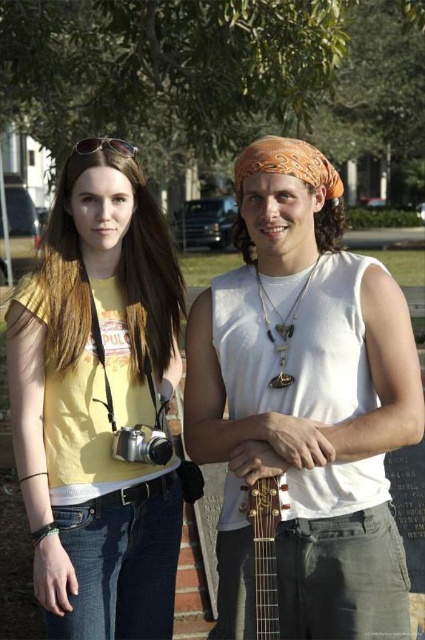
Is orange bandana at center above wooden acoustic guitar at center?

Yes, orange bandana at center is above wooden acoustic guitar at center.

Who is taller, orange bandana at center or wooden acoustic guitar at center?

orange bandana at center

Is point (295, 253) farther from viewer compared to point (255, 545)?

Yes.

The height and width of the screenshot is (640, 425). In order to click on orange bandana at center in this screenshot , I will do click(x=305, y=403).

Is orange bandana at center to the right of sunglasses at upper left from the viewer's perspective?

Yes, orange bandana at center is to the right of sunglasses at upper left.

Is point (263, 179) farther from viewer compared to point (118, 138)?

No, it is not.

Which is in front, point (229, 545) or point (125, 145)?

Point (229, 545) is in front.

Where is `orange bandana at center`? The width and height of the screenshot is (425, 640). orange bandana at center is located at coordinates (305, 403).

Does yellow matte t-shirt at center appear on the right side of sunglasses at upper left?

Correct, you'll find yellow matte t-shirt at center to the right of sunglasses at upper left.

Who is more distant from viewer, (10, 378) or (116, 147)?

Point (116, 147)

I want to click on yellow matte t-shirt at center, so click(98, 404).